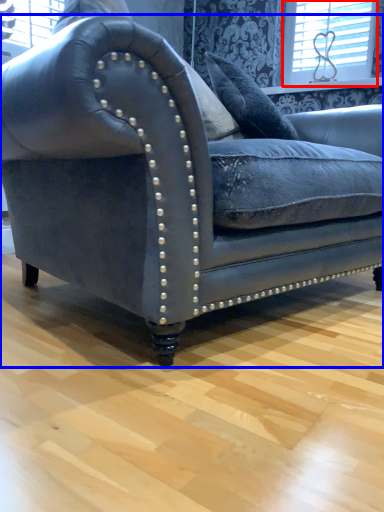
Question: Which point is further to the camera, window (highlighted by a red box) or studio couch (highlighted by a blue box)?

Choices:
 (A) window
 (B) studio couch

Answer: (A)